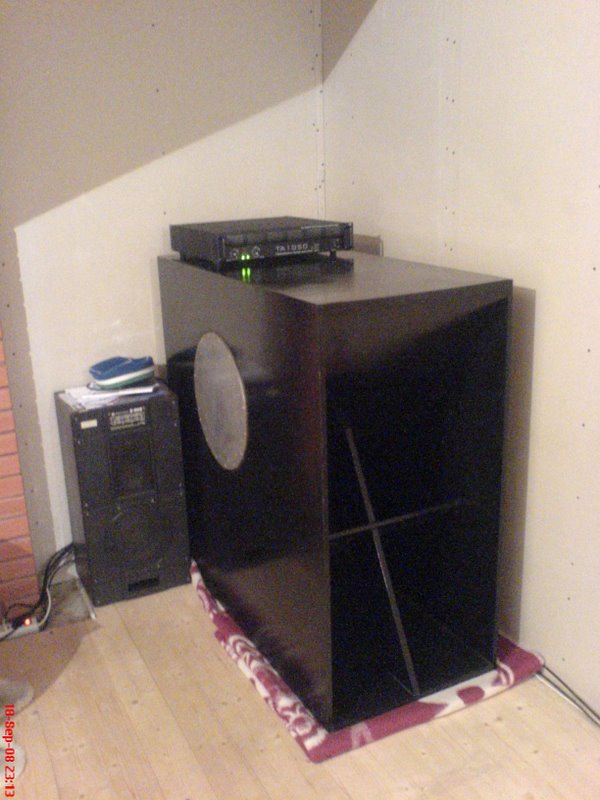
In order to click on purple towel in this screenshot , I will do `click(384, 718)`.